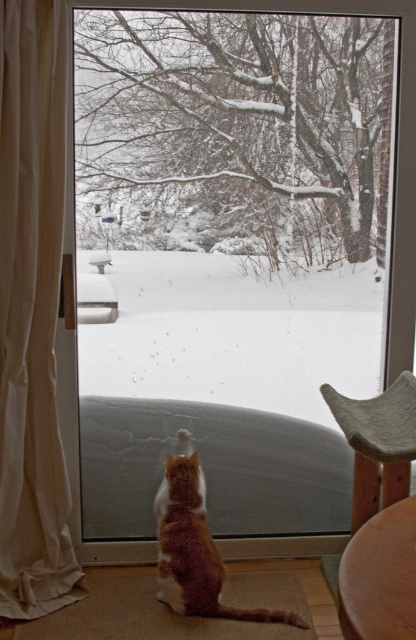
Does white fabric curtain at left have a smaller size compared to orange fur cat at center?

Incorrect, white fabric curtain at left is not smaller in size than orange fur cat at center.

Based on the photo, which is more to the right, white fabric curtain at left or orange fur cat at center?

orange fur cat at center is more to the right.

Measure the distance between point (9, 157) and camera.

Point (9, 157) is 7.91 feet from camera.

Where is `white fabric curtain at left`? white fabric curtain at left is located at coordinates (32, 312).

Which is in front, point (210, 180) or point (34, 35)?

Point (34, 35)

In the scene shown: Who is shorter, transparent glass screen door at center or white fabric curtain at left?

With less height is transparent glass screen door at center.

Find the location of a particular element. This screenshot has height=640, width=416. transparent glass screen door at center is located at coordinates pos(237,259).

Where is `transparent glass screen door at center`? The image size is (416, 640). transparent glass screen door at center is located at coordinates (237, 259).

Can you confirm if transparent glass screen door at center is positioned to the left of textured gray cushion at right?

Correct, you'll find transparent glass screen door at center to the left of textured gray cushion at right.

Between point (158, 140) and point (359, 515), which one is positioned in front?

Point (359, 515) is more forward.

Identify the location of transparent glass screen door at center. Image resolution: width=416 pixels, height=640 pixels. (237, 259).

The height and width of the screenshot is (640, 416). I want to click on transparent glass screen door at center, so (x=237, y=259).